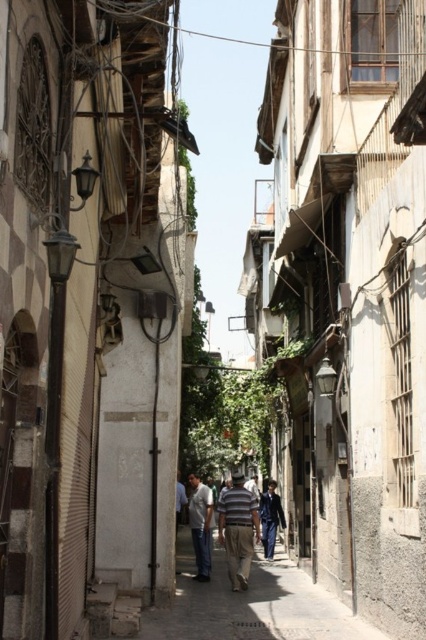
Question: Which point is farther from the camera taking this photo?

Choices:
 (A) (236, 506)
 (B) (198, 572)

Answer: (B)

Question: Can you confirm if striped cotton shirt at center is positioned to the right of light blue jeans at center?

Choices:
 (A) yes
 (B) no

Answer: (A)

Question: Can you confirm if striped cotton shirt at center is bigger than light blue jeans at center?

Choices:
 (A) yes
 (B) no

Answer: (A)

Question: Which of the following is the closest to the observer?

Choices:
 (A) (230, 512)
 (B) (198, 484)

Answer: (A)

Question: Is striped cotton shirt at center thinner than light blue jeans at center?

Choices:
 (A) no
 (B) yes

Answer: (A)

Question: Which object is closer to the camera taking this photo?

Choices:
 (A) light blue jeans at center
 (B) striped cotton shirt at center

Answer: (B)